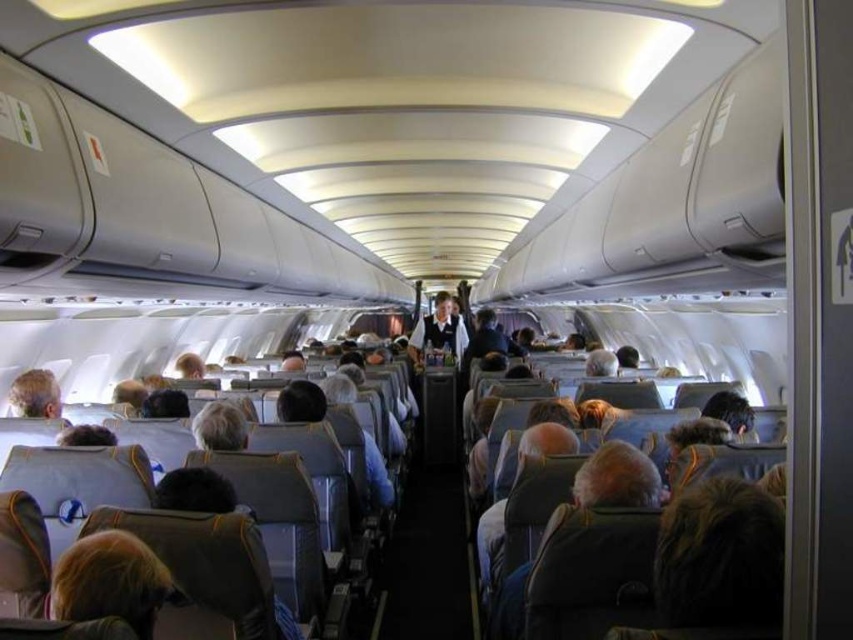
You are a passenger seated in the airplane cabin. You notice a point marked at coordinates (109, 580). What is located at this point?

The point at coordinates (109, 580) indicates the location of the blonde hair at lower left.

From the picture: You are a passenger sitting in the airplane cabin. You notice a flight attendant wearing a white shirt at center and a light brown leather headrest at lower left. Which object is closer to you?

The white shirt at center is closer to you because it is positioned over the light brown leather headrest at lower left, indicating it is in front of it from your perspective.

You are seated in the airplane cabin and notice a passenger with blonde hair at lower left. Based on their position, can you estimate how close they are to the front of the cabin?

The passenger with blonde hair at lower left is located at point (109, 580), which is near the front of the cabin since the perspective is from near the front looking towards the rear.